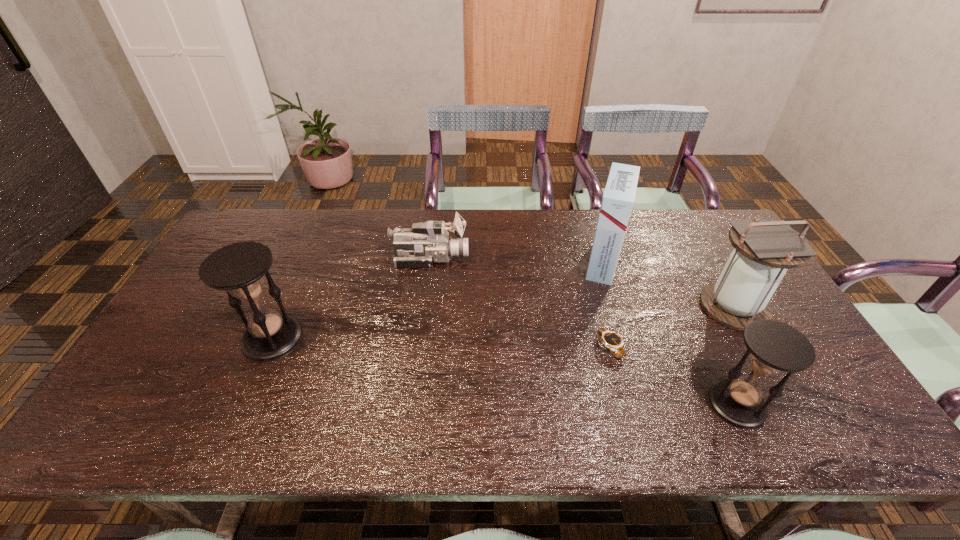
Identify the location of free space for an extra hourglass to achieve even spacing. (490, 369).